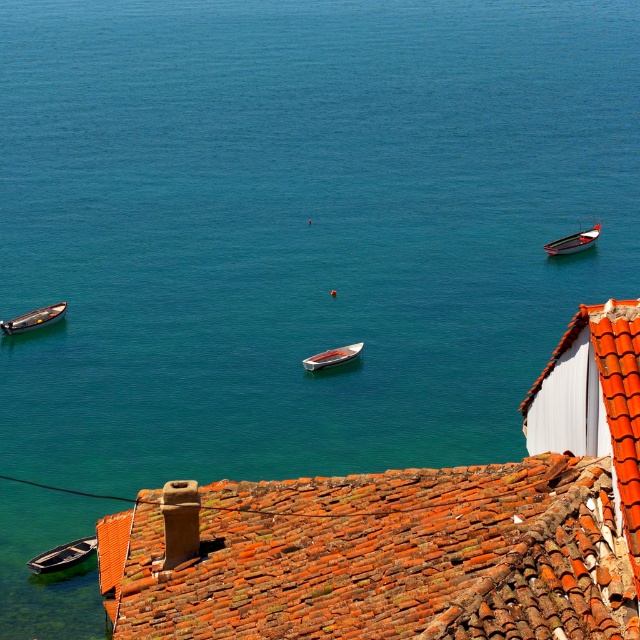
Question: Which object is positioned farthest from the wooden boat at lower left?

Choices:
 (A) rusty clay tiles at center
 (B) wooden boat at center
 (C) wooden boat at left
 (D) metallic red boat at right

Answer: (D)

Question: Is rusty clay tiles at center positioned in front of wooden boat at lower left?

Choices:
 (A) no
 (B) yes

Answer: (B)

Question: Can you confirm if metallic red boat at right is smaller than wooden boat at center?

Choices:
 (A) no
 (B) yes

Answer: (A)

Question: Considering the real-world distances, which object is farthest from the wooden boat at left?

Choices:
 (A) metallic red boat at right
 (B) rusty clay tiles at center

Answer: (B)

Question: Is metallic red boat at right bigger than wooden boat at left?

Choices:
 (A) no
 (B) yes

Answer: (B)

Question: Estimate the real-world distances between objects in this image. Which object is closer to the wooden boat at center?

Choices:
 (A) wooden boat at left
 (B) metallic red boat at right

Answer: (A)